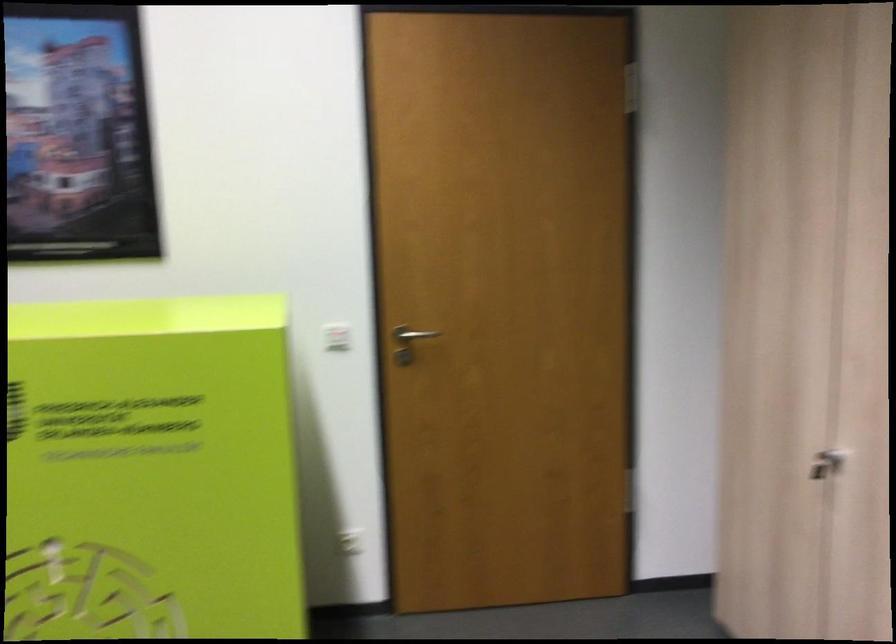
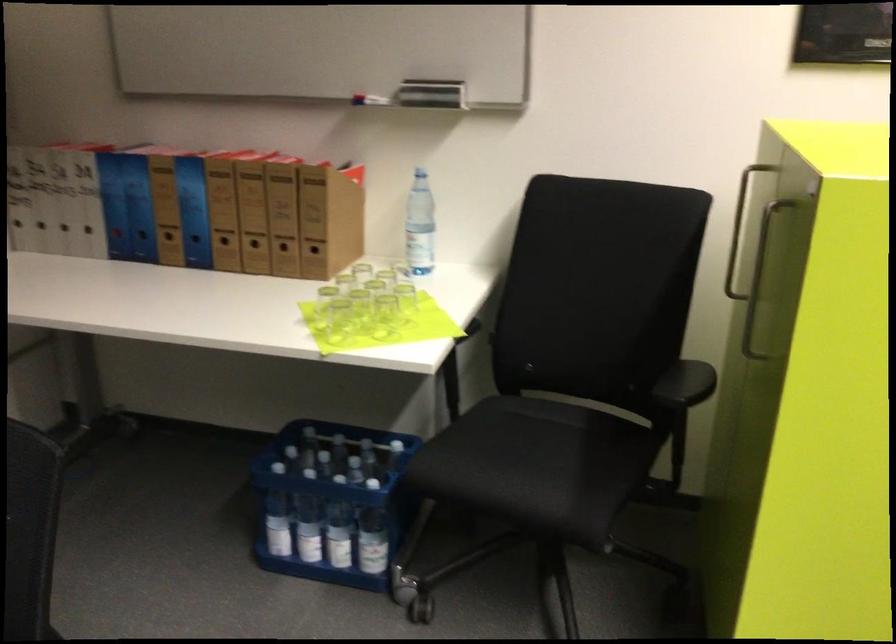
Question: In a continuous first-person perspective shot, in which direction is the camera moving?

Choices:
 (A) Left
 (B) Right
 (C) Forward
 (D) Backward

Answer: (A)